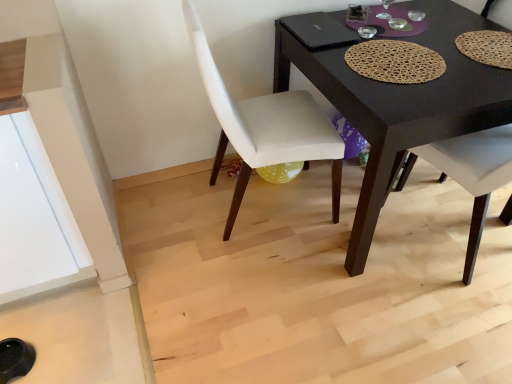
Locate an element on the screen. The height and width of the screenshot is (384, 512). spots to the right of brown woven placemat at center is located at coordinates (485, 68).